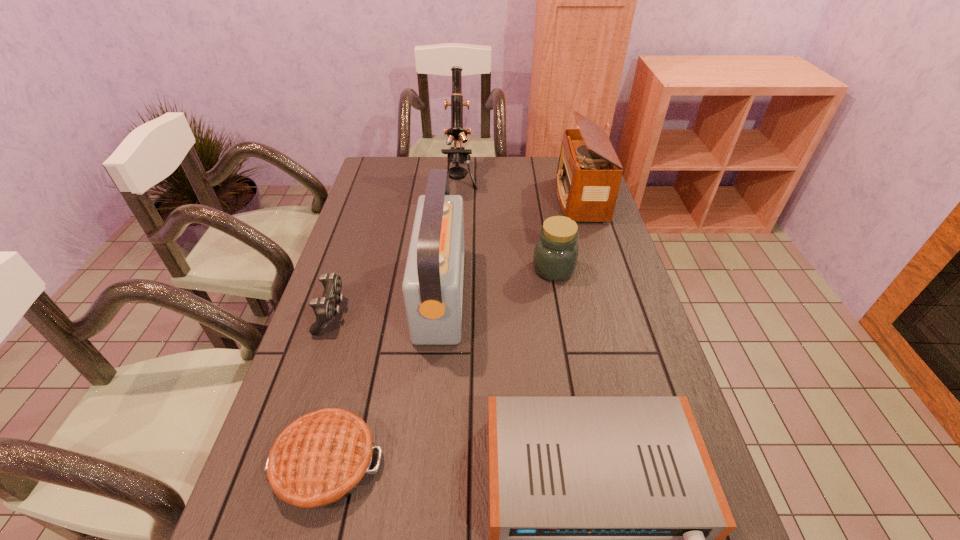
Where is `radio receiver that is the second closest to the fourth tallest object`? radio receiver that is the second closest to the fourth tallest object is located at coordinates pyautogui.click(x=432, y=286).

The height and width of the screenshot is (540, 960). In order to click on free space that satisfies the following two spatial constraints: 1. through the eyepiece of the tallest object; 2. on the right side of the fourth tallest object in this screenshot , I will do `click(453, 269)`.

Identify the location of free spot that satisfies the following two spatial constraints: 1. on the front-facing side of the leftmost radio receiver; 2. on the front side of the pie. (425, 463).

You are a GUI agent. You are given a task and a screenshot of the screen. Output one action in this format:
    pyautogui.click(x=<x>, y=<y>)
    Task: Click on the vacant region that satisfies the following two spatial constraints: 1. through the eyepiece of the tallest object; 2. on the right side of the jar
    Image resolution: width=960 pixels, height=540 pixels.
    Given the screenshot: What is the action you would take?
    pyautogui.click(x=453, y=269)

You are a GUI agent. You are given a task and a screenshot of the screen. Output one action in this format:
    pyautogui.click(x=<x>, y=<y>)
    Task: Click on the free location that satisfies the following two spatial constraints: 1. through the eyepiece of the microscope; 2. on the left side of the fourth tallest object
    This screenshot has height=540, width=960.
    Given the screenshot: What is the action you would take?
    pyautogui.click(x=453, y=269)

Find the location of `blank area in the image that satisfies the following two spatial constraints: 1. through the eyepiece of the microscope; 2. on the surface of the control with buttons`. blank area in the image that satisfies the following two spatial constraints: 1. through the eyepiece of the microscope; 2. on the surface of the control with buttons is located at coordinates (450, 314).